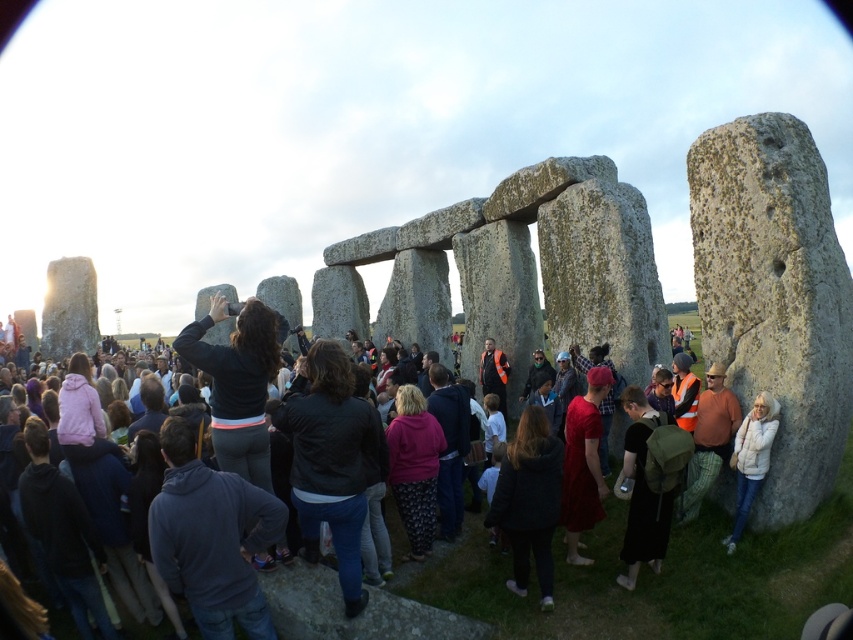
You are a photographer at Stonehenge and want to capture a photo that includes both the granite rock at center and the white fleece jacket at right. Which object should you focus on first if you want to ensure both are in the frame?

The granite rock at center is much taller than the white fleece jacket at right, so you should focus on the granite rock at center first to ensure it fits within the frame.

You are a photographer at Stonehenge and want to take a photo of the monument without any people in the frame. You notice the black matte backpack at lower right and the white fleece jacket at right. Which object is larger and might block your view more?

The black matte backpack at lower right is bigger than the white fleece jacket at right, so it might block your view more.

You are standing at the point marked by coordinates (531, 592) in the image of Stonehenge. What object are you directly facing?

The point marked by coordinates (531, 592) corresponds to the dark gray stone at center, so you are directly facing the dark gray stone at center.